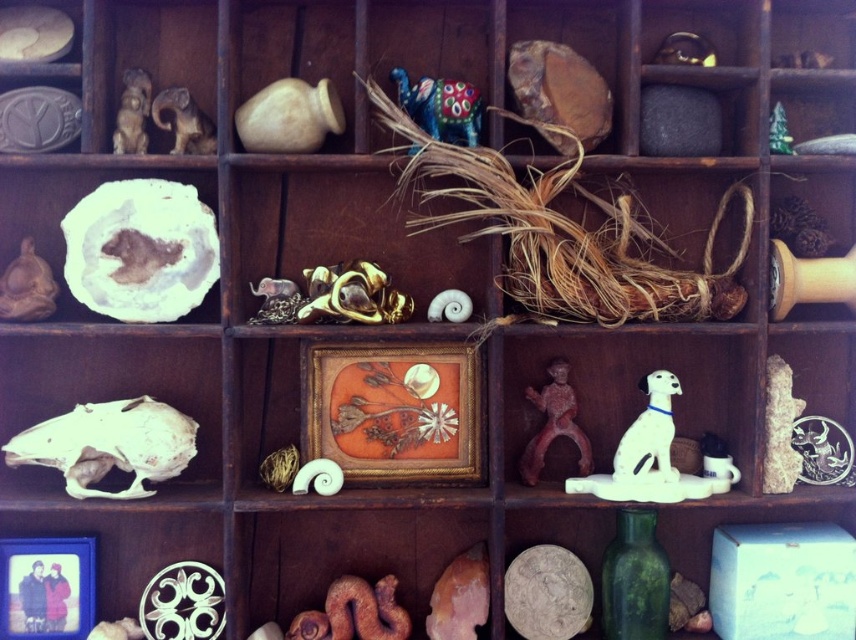
Is matte brown figurine at upper left in front of brown matte snake at lower center?

Yes, it is in front of brown matte snake at lower center.

Which is more to the right, matte brown figurine at upper left or brown matte snake at lower center?

brown matte snake at lower center is more to the right.

Based on the photo, who is more distant from viewer, [140,108] or [501,632]?

The point [501,632] is more distant.

The height and width of the screenshot is (640, 856). I want to click on matte brown figurine at upper left, so click(x=132, y=113).

Is white glossy dog at center right smaller than matte brown figurine at upper left?

Incorrect, white glossy dog at center right is not smaller in size than matte brown figurine at upper left.

Where is `white glossy dog at center right`? The image size is (856, 640). white glossy dog at center right is located at coordinates (649, 432).

Where is `white glossy dog at center right`? This screenshot has height=640, width=856. white glossy dog at center right is located at coordinates (649, 432).

Which is more to the right, white ceramic dog at center right or shiny multicolored elephant at center?

Positioned to the right is white ceramic dog at center right.

Find the location of `white ceramic dog at center right`. white ceramic dog at center right is located at coordinates (651, 456).

Find the location of a particular element. The height and width of the screenshot is (640, 856). white ceramic dog at center right is located at coordinates (651, 456).